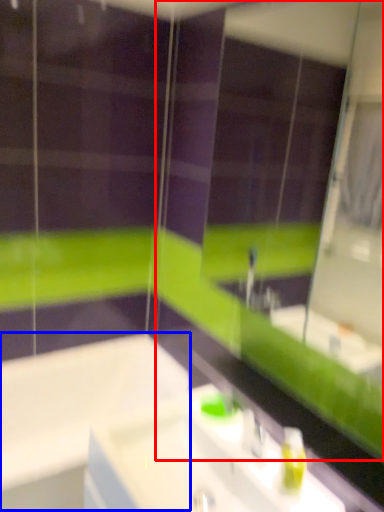
Question: Which object appears farthest to the camera in this image, mirror (highlighted by a red box) or bath (highlighted by a blue box)?

Choices:
 (A) mirror
 (B) bath

Answer: (B)